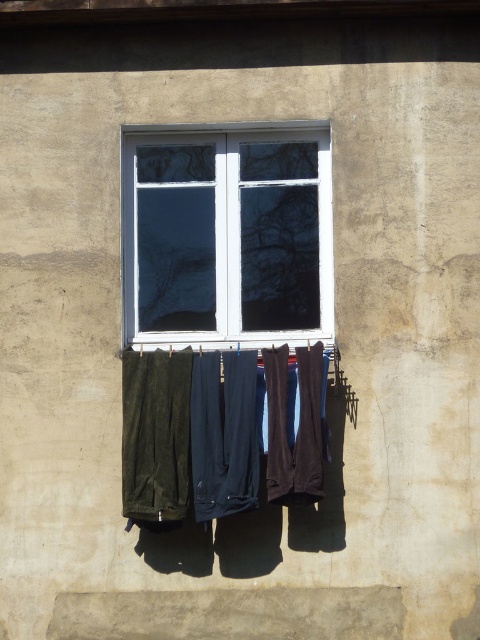
Question: Is white plastic window at center wider than velvet green pants at center?

Choices:
 (A) no
 (B) yes

Answer: (B)

Question: Which point is farther to the camera?

Choices:
 (A) velvet green pants at center
 (B) white plastic window at center

Answer: (B)

Question: Can you confirm if white plastic window at center is positioned to the left of velvet green pants at center?

Choices:
 (A) no
 (B) yes

Answer: (A)

Question: Does white plastic window at center have a smaller size compared to velvet green pants at center?

Choices:
 (A) no
 (B) yes

Answer: (A)